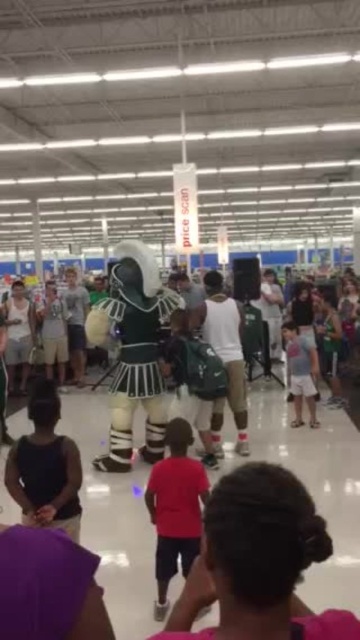
Who is positioned more to the left, red matte shirt at center or light blue denim shorts at center?

Positioned to the left is red matte shirt at center.

Which is behind, point (168, 428) or point (308, 378)?

Point (308, 378)

This screenshot has width=360, height=640. I want to click on red matte shirt at center, so click(174, 508).